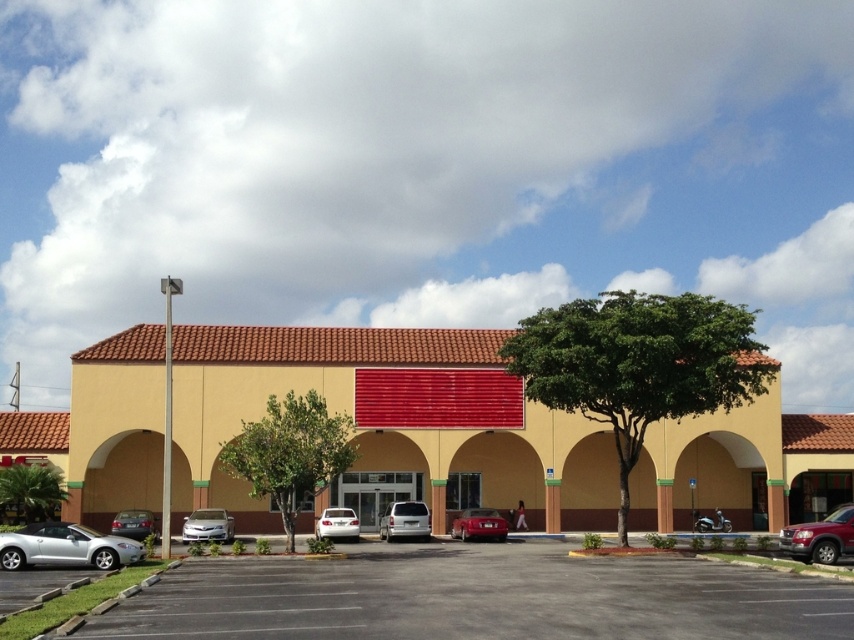
Describe the element at coordinates (65, 547) in the screenshot. I see `silver metallic car at lower left` at that location.

What do you see at coordinates (65, 547) in the screenshot?
I see `silver metallic car at lower left` at bounding box center [65, 547].

The height and width of the screenshot is (640, 854). In order to click on silver metallic car at lower left in this screenshot , I will do `click(65, 547)`.

Is silver metallic sedan at lower left taller than white matte sedan at center?

No.

Between silver metallic sedan at lower left and white matte sedan at center, which one appears on the left side from the viewer's perspective?

silver metallic sedan at lower left is more to the left.

The width and height of the screenshot is (854, 640). Describe the element at coordinates (208, 525) in the screenshot. I see `silver metallic sedan at lower left` at that location.

The height and width of the screenshot is (640, 854). What are the coordinates of `silver metallic sedan at lower left` in the screenshot? It's located at (208, 525).

Is yellow stucco building at center smaller than white matte sedan at center?

Actually, yellow stucco building at center might be larger than white matte sedan at center.

Which is behind, point (603, 458) or point (349, 536)?

Point (603, 458)

This screenshot has height=640, width=854. What are the coordinates of `yellow stucco building at center` in the screenshot? It's located at (390, 420).